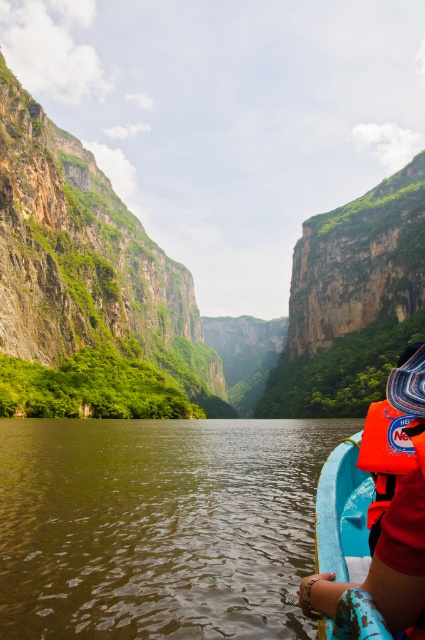
Does orange life vest at lower right appear on the left side of orange fabric life jacket at right?

Yes, orange life vest at lower right is to the left of orange fabric life jacket at right.

Who is positioned more to the right, orange life vest at lower right or orange fabric life jacket at right?

Positioned to the right is orange fabric life jacket at right.

Between point (384, 522) and point (402, 419), which one is positioned behind?

Positioned behind is point (402, 419).

Locate an element on the screen. This screenshot has width=425, height=640. orange life vest at lower right is located at coordinates (391, 529).